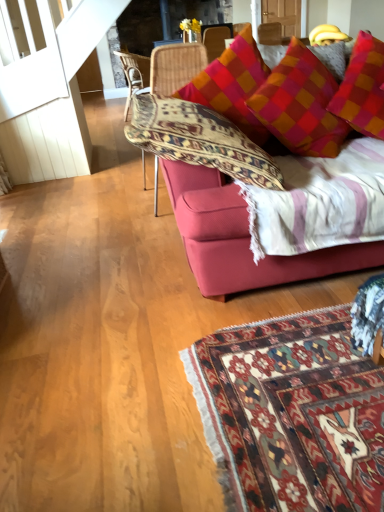
Question: From a real-world perspective, is velvet red couch at upper right positioned above or below woven wicker chair at center, which appears as the 2th chair when viewed from the top?

Choices:
 (A) above
 (B) below

Answer: (B)

Question: Is velvet red couch at upper right taller or shorter than woven wicker chair at center, the first chair in the bottom-to-top sequence?

Choices:
 (A) tall
 (B) short

Answer: (B)

Question: Based on their relative distances, which object is nearer to the woven rattan chair at center, marked as the 1th chair in a left-to-right arrangement?

Choices:
 (A) woven wicker chair at center, which appears as the 2th chair when viewed from the top
 (B) velvet red couch at upper right

Answer: (A)

Question: Which is nearer to the woven wicker chair at center, which is counted as the 2th chair, starting from the left?

Choices:
 (A) velvet red couch at upper right
 (B) woven rattan chair at center, the 2th chair viewed from the front

Answer: (A)